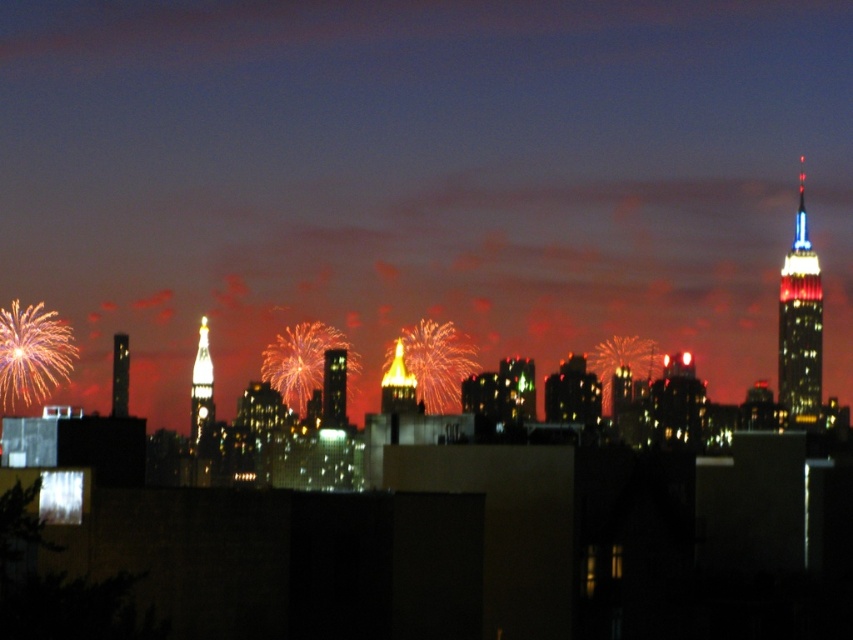
Question: Does blue glass skyscraper at right have a greater width compared to shiny glass skyscraper at center?

Choices:
 (A) no
 (B) yes

Answer: (B)

Question: Which is farther from the blue glass skyscraper at right?

Choices:
 (A) golden glass spire at center
 (B) shiny glass skyscraper at center
 (C) metallic glass skyscraper at left
 (D) shiny gold clock tower at center

Answer: (C)

Question: Estimate the real-world distances between objects in this image. Which object is farther from the blue glass skyscraper at right?

Choices:
 (A) metallic glass skyscraper at left
 (B) shiny gold clock tower at center
 (C) shiny glass skyscraper at center

Answer: (A)

Question: Is blue glass skyscraper at right positioned in front of shiny gold clock tower at center?

Choices:
 (A) no
 (B) yes

Answer: (A)

Question: Which object is farther from the camera taking this photo?

Choices:
 (A) blue glass skyscraper at right
 (B) metallic glass skyscraper at left
 (C) shiny gold clock tower at center
 (D) shiny glass skyscraper at center

Answer: (A)

Question: Considering the relative positions of shiny gold clock tower at center and metallic glass skyscraper at left in the image provided, where is shiny gold clock tower at center located with respect to metallic glass skyscraper at left?

Choices:
 (A) above
 (B) below

Answer: (B)